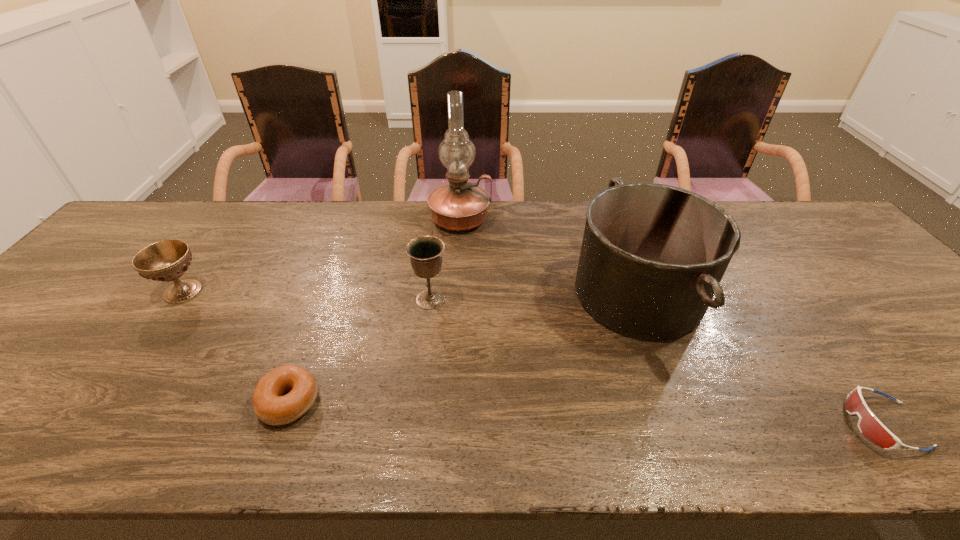
Find the location of `vacant area that lies between the fifth object from left to right and the goggles`. vacant area that lies between the fifth object from left to right and the goggles is located at coordinates (760, 359).

Locate an element on the screen. This screenshot has height=540, width=960. empty location between the third tallest object and the second object from right to left is located at coordinates coord(534,296).

Identify the location of free space between the fourth shortest object and the rightmost object. (657, 362).

The image size is (960, 540). What are the coordinates of `free spot between the oil lamp and the third shortest object` in the screenshot? It's located at (322, 255).

Where is `blank region between the shorter chalice and the tallest object`? The width and height of the screenshot is (960, 540). blank region between the shorter chalice and the tallest object is located at coordinates (322, 255).

You are a GUI agent. You are given a task and a screenshot of the screen. Output one action in this format:
    pyautogui.click(x=<x>, y=<y>)
    Task: Click on the blank region between the fourth shortest object and the goggles
    This screenshot has width=960, height=540.
    Given the screenshot: What is the action you would take?
    pyautogui.click(x=657, y=362)

Identify the location of free space between the right chalice and the second tallest object. (534, 296).

This screenshot has height=540, width=960. I want to click on object that can be found as the second closest to the right chalice, so click(270, 406).

Where is `the fifth closest object relative to the goggles`? the fifth closest object relative to the goggles is located at coordinates (167, 260).

The width and height of the screenshot is (960, 540). In order to click on free space that satisfies the following two spatial constraints: 1. on the back side of the bagel; 2. on the right side of the pan in this screenshot , I will do `click(328, 294)`.